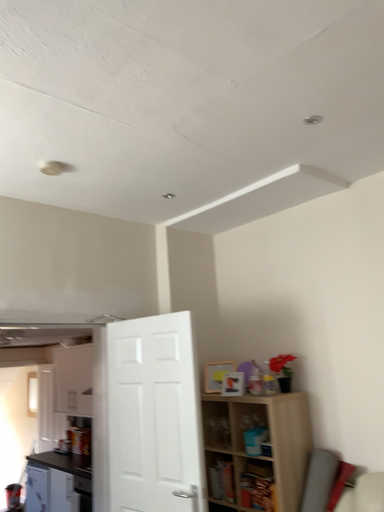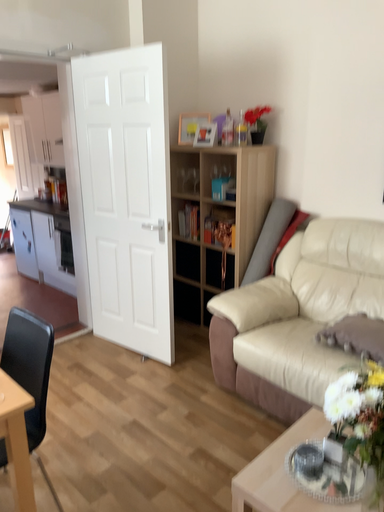
Question: How did the camera likely rotate when shooting the video?

Choices:
 (A) rotated upward
 (B) rotated downward

Answer: (B)